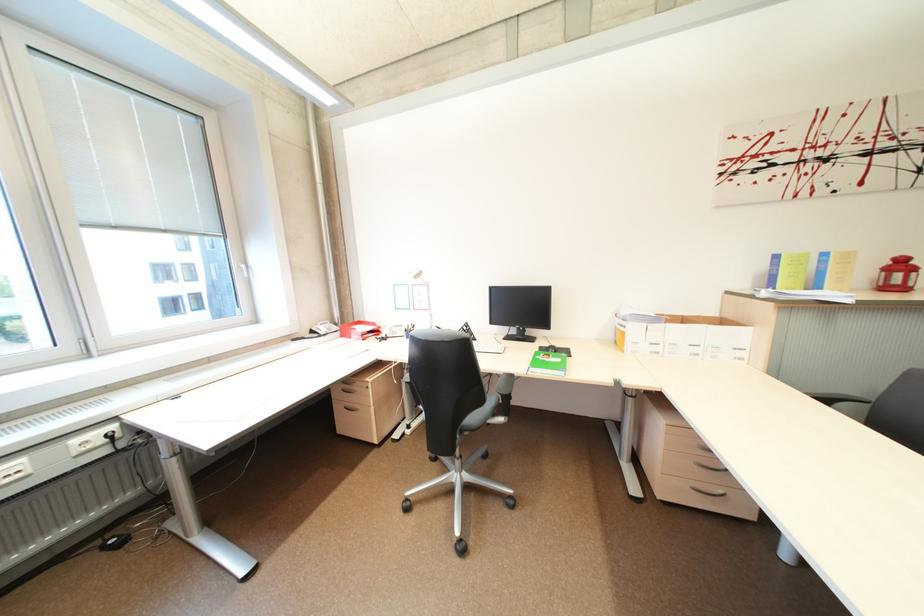
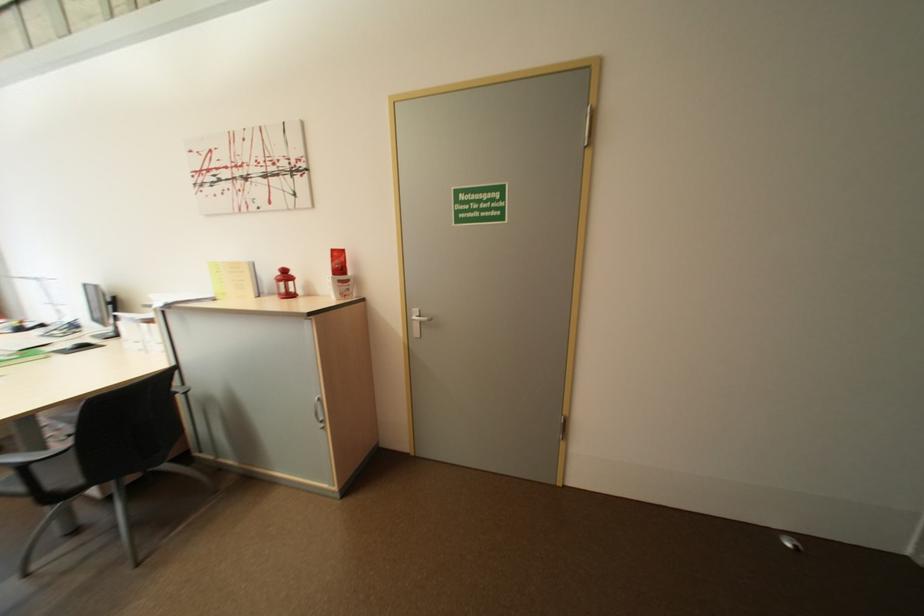
Question: I am providing you with two images of the same scene from different viewpoints. Which of the following objects are not visible in image2?

Choices:
 (A) white plastic cup
 (B) chair armrest
 (C) gray throw pillow
 (D) gray chair armrest

Answer: (D)